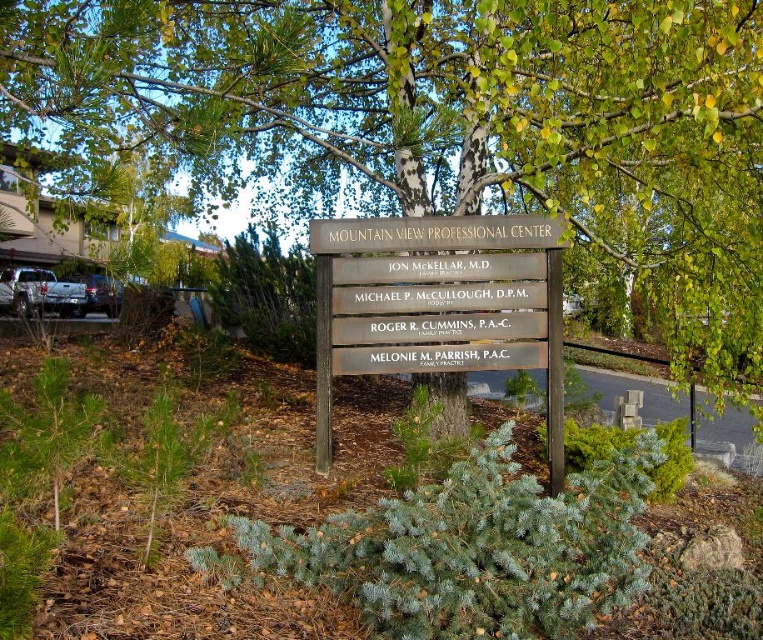
Question: Is green bark tree at center to the left of wooden sign at center from the viewer's perspective?

Choices:
 (A) yes
 (B) no

Answer: (B)

Question: Is green bark tree at center above wooden sign at center?

Choices:
 (A) yes
 (B) no

Answer: (B)

Question: Does green bark tree at center have a lesser width compared to wooden sign at center?

Choices:
 (A) no
 (B) yes

Answer: (B)

Question: Which of the following is the farthest from the observer?

Choices:
 (A) wooden sign at center
 (B) green bark tree at center

Answer: (B)

Question: Which of the following is the closest to the observer?

Choices:
 (A) green bark tree at center
 (B) wooden sign at center

Answer: (B)